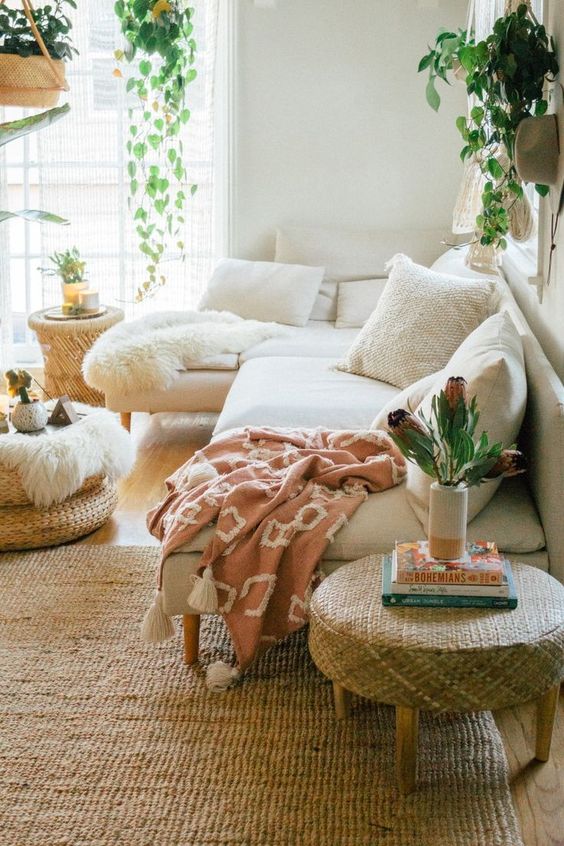
This screenshot has height=846, width=564. I want to click on hanging plants, so click(x=157, y=35), click(x=164, y=119), click(x=149, y=250), click(x=506, y=63), click(x=41, y=56).